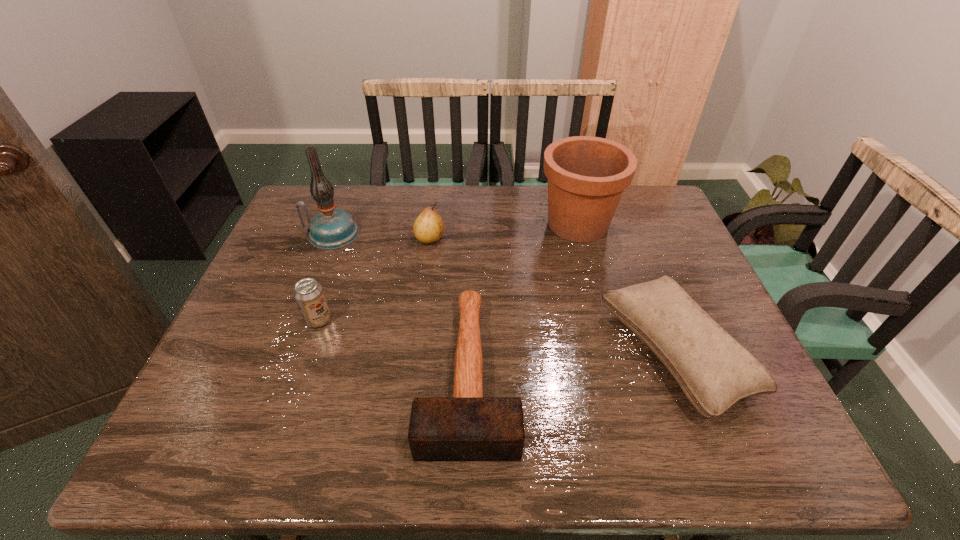
This screenshot has width=960, height=540. Identify the location of oil lamp. (331, 228).

The image size is (960, 540). I want to click on the second tallest object, so click(587, 175).

Identify the location of pear. Image resolution: width=960 pixels, height=540 pixels. (428, 228).

Image resolution: width=960 pixels, height=540 pixels. Identify the location of beer can. (308, 293).

The image size is (960, 540). In order to click on cushion in this screenshot , I will do `click(714, 371)`.

Find the location of a particular element. mallet is located at coordinates (466, 427).

In order to click on free space located on the right of the oil lamp in this screenshot , I will do [375, 234].

This screenshot has width=960, height=540. I want to click on vacant point located on the right of the second tallest object, so click(669, 224).

Where is `free location located on the front of the pear`? The width and height of the screenshot is (960, 540). free location located on the front of the pear is located at coordinates (425, 274).

The width and height of the screenshot is (960, 540). Identify the location of free space located on the right of the beer can. (351, 320).